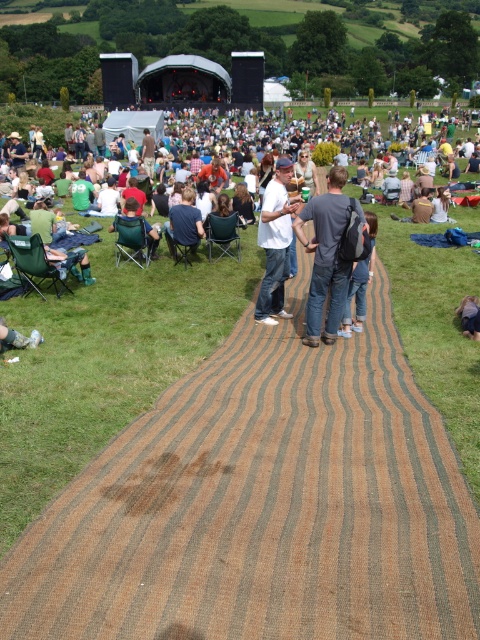
Where is `denim jeans at center`? This screenshot has height=640, width=480. denim jeans at center is located at coordinates (360, 282).

Which is behind, point (343, 332) or point (476, 328)?

Point (343, 332)

Between point (351, 330) and point (468, 301), which one is positioned behind?

The point (468, 301) is more distant.

This screenshot has width=480, height=640. What are the coordinates of `denim jeans at center` in the screenshot? It's located at (360, 282).

Who is lower down, dark gray backpack at center or denim jeans at center?

denim jeans at center

The image size is (480, 640). Find the location of `dark gray backpack at center`. dark gray backpack at center is located at coordinates (326, 253).

The width and height of the screenshot is (480, 640). What are the coordinates of `dark gray backpack at center` in the screenshot? It's located at (326, 253).

Can you confirm if brown striped carpet at center is positioned below dark gray backpack at center?

No.

Which is behind, point (119, 314) or point (333, 243)?

The point (119, 314) is more distant.

Is point (406, 264) in front of point (312, 248)?

No.

Where is `brown striped carpet at center`? Image resolution: width=480 pixels, height=640 pixels. brown striped carpet at center is located at coordinates (106, 362).